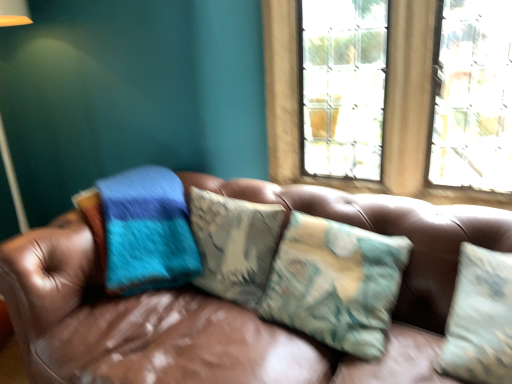
Question: Is camouflage fabric pillow at center not near brown leather couch at center?

Choices:
 (A) yes
 (B) no

Answer: (B)

Question: Is camouflage fabric pillow at center oriented towards brown leather couch at center?

Choices:
 (A) no
 (B) yes

Answer: (B)

Question: From the image's perspective, does camouflage fabric pillow at center appear higher than brown leather couch at center?

Choices:
 (A) yes
 (B) no

Answer: (A)

Question: Is camouflage fabric pillow at center wider than brown leather couch at center?

Choices:
 (A) no
 (B) yes

Answer: (A)

Question: Does camouflage fabric pillow at center appear on the right side of brown leather couch at center?

Choices:
 (A) yes
 (B) no

Answer: (A)

Question: From the image's perspective, is brown leather couch at center positioned above or below clear glass window at upper center?

Choices:
 (A) below
 (B) above

Answer: (A)

Question: Which is correct: brown leather couch at center is inside clear glass window at upper center, or outside of it?

Choices:
 (A) inside
 (B) outside

Answer: (B)

Question: From a real-world perspective, relative to clear glass window at upper center, is brown leather couch at center vertically above or below?

Choices:
 (A) above
 (B) below

Answer: (B)

Question: Considering the relative positions of brown leather couch at center and clear glass window at upper center in the image provided, is brown leather couch at center to the left or to the right of clear glass window at upper center?

Choices:
 (A) left
 (B) right

Answer: (A)

Question: Is camouflage fabric pillow at center in front of or behind clear glass window at upper center in the image?

Choices:
 (A) front
 (B) behind

Answer: (A)

Question: Is camouflage fabric pillow at center situated inside clear glass window at upper center or outside?

Choices:
 (A) outside
 (B) inside

Answer: (A)

Question: Is camouflage fabric pillow at center wider or thinner than clear glass window at upper center?

Choices:
 (A) thin
 (B) wide

Answer: (B)

Question: Is camouflage fabric pillow at center bigger or smaller than clear glass window at upper center?

Choices:
 (A) small
 (B) big

Answer: (A)

Question: In terms of width, does brown leather couch at center look wider or thinner when compared to camouflage fabric pillow at center?

Choices:
 (A) thin
 (B) wide

Answer: (B)

Question: Based on their positions, is brown leather couch at center located to the left or right of camouflage fabric pillow at center?

Choices:
 (A) right
 (B) left

Answer: (B)